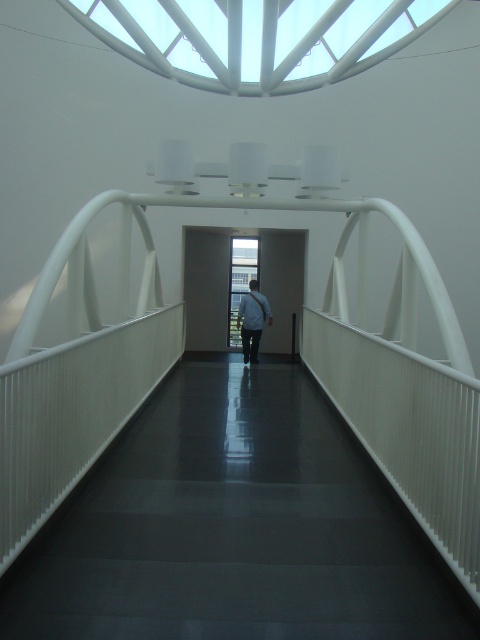
Question: Which point appears closest to the camera in this image?

Choices:
 (A) (295, 540)
 (B) (252, 310)

Answer: (A)

Question: Is black glossy path at center positioned in front of white fabric bag at center?

Choices:
 (A) yes
 (B) no

Answer: (A)

Question: Does black glossy path at center have a lesser width compared to white fabric bag at center?

Choices:
 (A) yes
 (B) no

Answer: (B)

Question: Can you confirm if black glossy path at center is positioned to the left of white fabric bag at center?

Choices:
 (A) no
 (B) yes

Answer: (A)